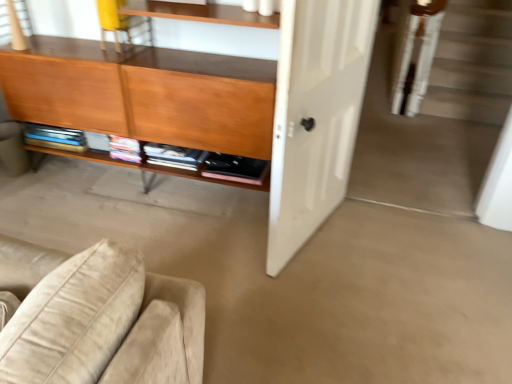
This screenshot has height=384, width=512. Find the location of `white matte door at center`. white matte door at center is located at coordinates (315, 115).

This screenshot has height=384, width=512. What are the coordinates of `white matte door at center` in the screenshot? It's located at 315,115.

Looking at this image, from the image's perspective, between matte wood cabinet at left and white matte door at center, which one is located above?

matte wood cabinet at left, from the image's perspective.

Is matte wood cabinet at left positioned with its back to white matte door at center?

matte wood cabinet at left is not turned away from white matte door at center.

From a real-world perspective, is matte wood cabinet at left beneath white matte door at center?

No.

Measure the distance from matte wood cabinet at left to white matte door at center.

A distance of 54.62 centimeters exists between matte wood cabinet at left and white matte door at center.

Considering the positions of objects white matte door at center and clear glass window at upper left in the image provided, who is more to the left, white matte door at center or clear glass window at upper left?

From the viewer's perspective, clear glass window at upper left appears more on the left side.

Considering the points (302, 88) and (1, 32), which point is in front, point (302, 88) or point (1, 32)?

Point (302, 88)

Is white matte door at center next to clear glass window at upper left?

No, white matte door at center is not touching clear glass window at upper left.

In order to click on door on the right of clear glass window at upper left in this screenshot , I will do `click(315, 115)`.

Between clear glass window at upper left and matte wood cabinet at left, which one appears on the right side from the viewer's perspective?

From the viewer's perspective, matte wood cabinet at left appears more on the right side.

Is clear glass window at upper left facing towards matte wood cabinet at left?

Yes.

In terms of height, does clear glass window at upper left look taller or shorter compared to matte wood cabinet at left?

clear glass window at upper left is shorter than matte wood cabinet at left.

From a real-world perspective, does clear glass window at upper left stand above matte wood cabinet at left?

Yes, from a real-world perspective, clear glass window at upper left is above matte wood cabinet at left.

Where is `door directly beneath the yellow fabric chair at upper left (from a real-world perspective)`? The width and height of the screenshot is (512, 384). door directly beneath the yellow fabric chair at upper left (from a real-world perspective) is located at coordinates (315, 115).

Which object is further away from the camera, white matte door at center or yellow fabric chair at upper left?

yellow fabric chair at upper left is further from the camera.

Does white matte door at center turn towards yellow fabric chair at upper left?

No.

Between clear glass window at upper left and white matte door at center, which one has larger size?

With larger size is white matte door at center.

Identify the location of door below the clear glass window at upper left (from the image's perspective). (315, 115).

How far apart are clear glass window at upper left and white matte door at center?

A distance of 5.44 feet exists between clear glass window at upper left and white matte door at center.

Which is behind, point (19, 4) or point (278, 127)?

The point (19, 4) is behind.

The width and height of the screenshot is (512, 384). I want to click on chair above the white matte door at center (from the image's perspective), so click(118, 22).

Which object is positioned more to the left, yellow fabric chair at upper left or white matte door at center?

yellow fabric chair at upper left.

From a real-world perspective, is yellow fabric chair at upper left over white matte door at center?

Yes, from a real-world perspective, yellow fabric chair at upper left is over white matte door at center

From the picture: In the image, is yellow fabric chair at upper left positioned in front of or behind white matte door at center?

yellow fabric chair at upper left is positioned farther from the viewer than white matte door at center.

Does matte wood cabinet at left have a larger size compared to yellow fabric chair at upper left?

Yes.

Is matte wood cabinet at left located outside yellow fabric chair at upper left?

Indeed, matte wood cabinet at left is completely outside yellow fabric chair at upper left.

From the picture: From the image's perspective, which one is positioned higher, matte wood cabinet at left or yellow fabric chair at upper left?

yellow fabric chair at upper left appears higher in the image.

This screenshot has width=512, height=384. I want to click on cabinetry lying above the white matte door at center (from the image's perspective), so click(144, 93).

Locate an element on the screen. The width and height of the screenshot is (512, 384). window on the left of white matte door at center is located at coordinates (5, 23).

When comparing their distances from yellow fabric chair at upper left, does matte wood cabinet at left or white matte door at center seem further?

white matte door at center is further to yellow fabric chair at upper left.

Looking at the image, which one is located closer to matte wood cabinet at left, white matte door at center or yellow fabric chair at upper left?

Based on the image, yellow fabric chair at upper left appears to be nearer to matte wood cabinet at left.

Based on their spatial positions, is clear glass window at upper left or white matte door at center closer to yellow fabric chair at upper left?

clear glass window at upper left is closer to yellow fabric chair at upper left.

Which object lies further to the anchor point white matte door at center, matte wood cabinet at left or clear glass window at upper left?

clear glass window at upper left.

Which object lies further to the anchor point matte wood cabinet at left, white matte door at center or clear glass window at upper left?

Among the two, clear glass window at upper left is located further to matte wood cabinet at left.

When comparing their distances from white matte door at center, does yellow fabric chair at upper left or clear glass window at upper left seem closer?

yellow fabric chair at upper left.

From the image, which object appears to be farther from matte wood cabinet at left, yellow fabric chair at upper left or white matte door at center?

The object further to matte wood cabinet at left is white matte door at center.

Which object lies further to the anchor point matte wood cabinet at left, clear glass window at upper left or white matte door at center?

clear glass window at upper left lies further to matte wood cabinet at left than the other object.

The width and height of the screenshot is (512, 384). In order to click on cabinetry between yellow fabric chair at upper left and white matte door at center in this screenshot , I will do `click(144, 93)`.

You are a GUI agent. You are given a task and a screenshot of the screen. Output one action in this format:
    pyautogui.click(x=<x>, y=<y>)
    Task: Click on the cabinetry located between clear glass window at upper left and white matte door at center in the left-right direction
    
    Given the screenshot: What is the action you would take?
    pyautogui.click(x=144, y=93)

The height and width of the screenshot is (384, 512). I want to click on chair located between clear glass window at upper left and matte wood cabinet at left in the left-right direction, so click(x=118, y=22).

The height and width of the screenshot is (384, 512). I want to click on chair situated between clear glass window at upper left and white matte door at center from left to right, so click(x=118, y=22).